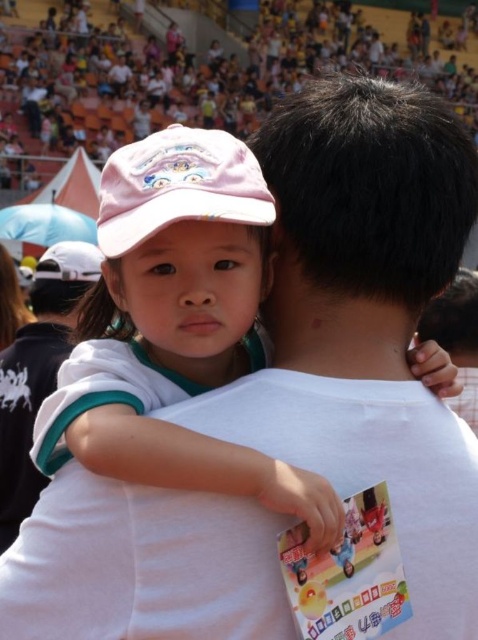
Question: Which of the following is the farthest from the observer?

Choices:
 (A) white matte baseball cap at upper left
 (B) white cotton shirt at left

Answer: (A)

Question: Is pink fabric baseball cap at upper left below white matte baseball cap at upper left?

Choices:
 (A) yes
 (B) no

Answer: (A)

Question: Considering the real-world distances, which object is farthest from the white cotton shirt at left?

Choices:
 (A) pink fabric baseball cap at upper left
 (B) white matte baseball cap at upper left

Answer: (A)

Question: Which object is closer to the camera taking this photo?

Choices:
 (A) white cotton shirt at left
 (B) white matte baseball cap at upper left

Answer: (A)

Question: Can you confirm if white cotton shirt at left is smaller than white matte baseball cap at upper left?

Choices:
 (A) no
 (B) yes

Answer: (B)

Question: Does white cotton shirt at left appear on the left side of white matte baseball cap at upper left?

Choices:
 (A) no
 (B) yes

Answer: (A)